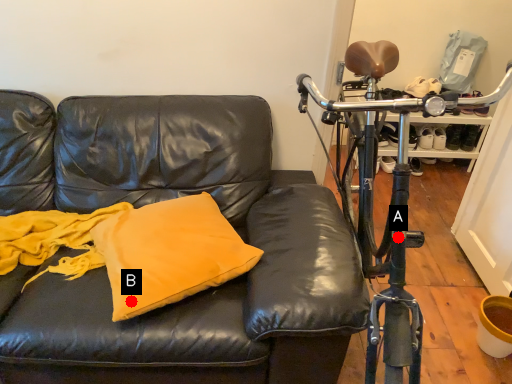
Question: Two points are circled on the image, labeled by A and B beside each circle. Which point appears farthest from the camera in this image?

Choices:
 (A) A is further
 (B) B is further

Answer: (B)